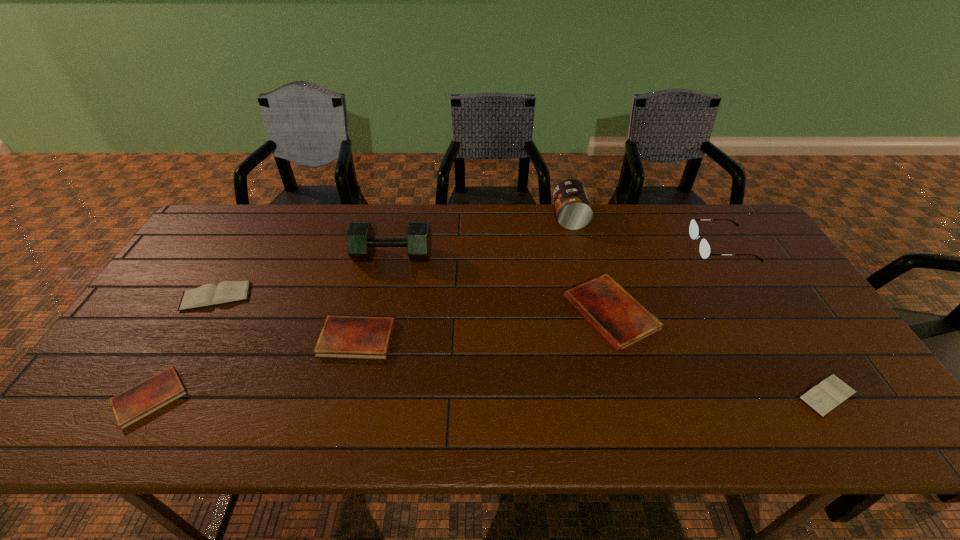
Locate an element on the screen. Image resolution: width=960 pixels, height=540 pixels. free spot between the dumbbell and the farther brown diary is located at coordinates (304, 276).

At what (x,y) coordinates should I click in order to perform the action: click on free space between the biggest red diary and the can. Please return your answer as a coordinate pair (x, y). The height and width of the screenshot is (540, 960). Looking at the image, I should click on (590, 265).

At what (x,y) coordinates should I click in order to perform the action: click on free area in between the can and the spectacles. Please return your answer as a coordinate pair (x, y). Looking at the image, I should click on (646, 232).

Locate an element on the screen. free spot between the bigger brown diary and the right brown diary is located at coordinates (522, 346).

Where is `free space between the dumbbell and the can`? free space between the dumbbell and the can is located at coordinates (481, 237).

Identify the location of vacant area that lies between the dumbbell and the rightmost red diary. Image resolution: width=960 pixels, height=540 pixels. (502, 285).

You are a GUI agent. You are given a task and a screenshot of the screen. Output one action in this format:
    pyautogui.click(x=<x>, y=<y>)
    Task: Click on the vacant point located between the third tallest object and the dumbbell
    The image size is (960, 540).
    Given the screenshot: What is the action you would take?
    pyautogui.click(x=558, y=251)

Identify the location of free space between the black spectacles and the can. The image size is (960, 540). (646, 232).

The height and width of the screenshot is (540, 960). What are the coordinates of `unoccupied area between the smaller brown diary and the can` in the screenshot? It's located at (699, 306).

Choose which object is the sixth nearest neighbor to the can. Please provide its 2D coordinates. Your answer should be formatted as a tuple, i.e. [(x, y)], where the tuple contains the x and y coordinates of a point satisfying the conditions above.

[(206, 295)]